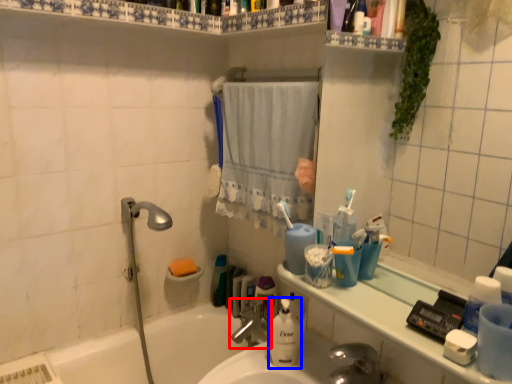
Question: Which of the following is the farthest to the observer, tap (highlighted by a red box) or cleaning product (highlighted by a blue box)?

Choices:
 (A) tap
 (B) cleaning product

Answer: (A)